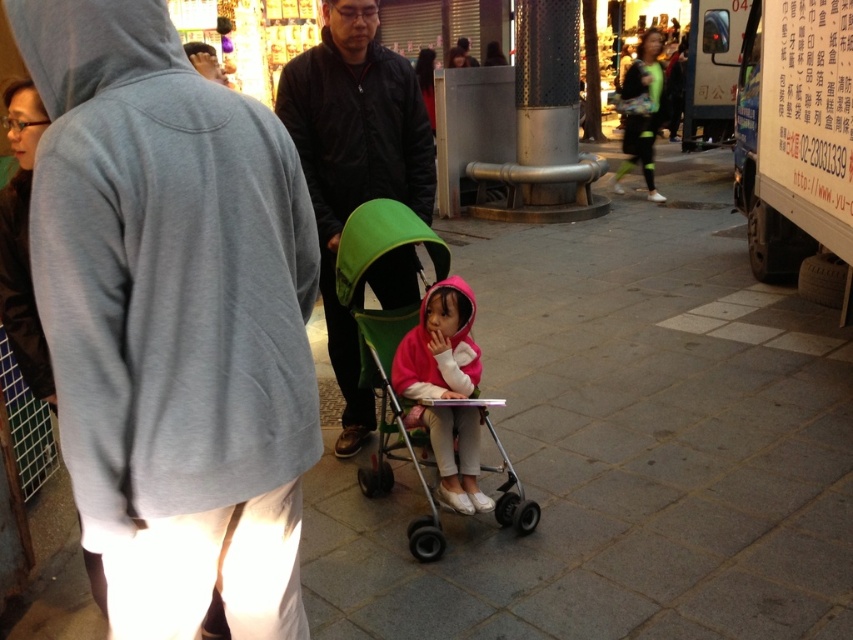
Question: Based on their relative distances, which object is nearer to the green fabric stroller at center?

Choices:
 (A) pink fleece jacket at center
 (B) dark brown fur coat at left

Answer: (A)

Question: Is dark brown leather jacket at center to the right of matte black jacket at center from the viewer's perspective?

Choices:
 (A) no
 (B) yes

Answer: (A)

Question: Which is farther from the gray cotton hoodie at upper left?

Choices:
 (A) matte black jacket at center
 (B) green fabric stroller at center
 (C) green mesh leggings at right
 (D) dark brown leather jacket at center

Answer: (C)

Question: Is dark brown leather jacket at center below green fabric stroller at center?

Choices:
 (A) yes
 (B) no

Answer: (B)

Question: Is pink fleece jacket at center wider than green mesh leggings at right?

Choices:
 (A) yes
 (B) no

Answer: (B)

Question: Considering the real-world distances, which object is farthest from the matte black jacket at center?

Choices:
 (A) dark brown leather jacket at center
 (B) green fabric stroller at center
 (C) pink fleece jacket at center

Answer: (C)